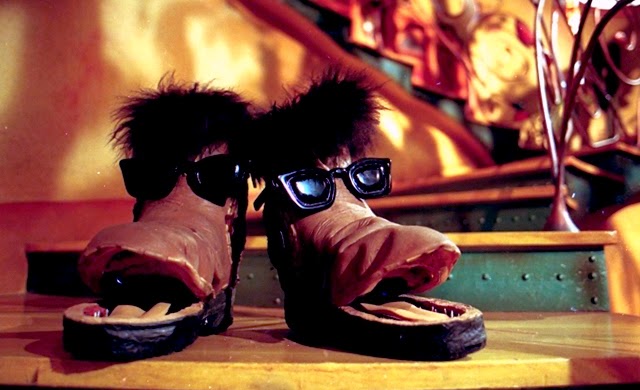
The height and width of the screenshot is (390, 640). Identify the location of wall. (219, 60).